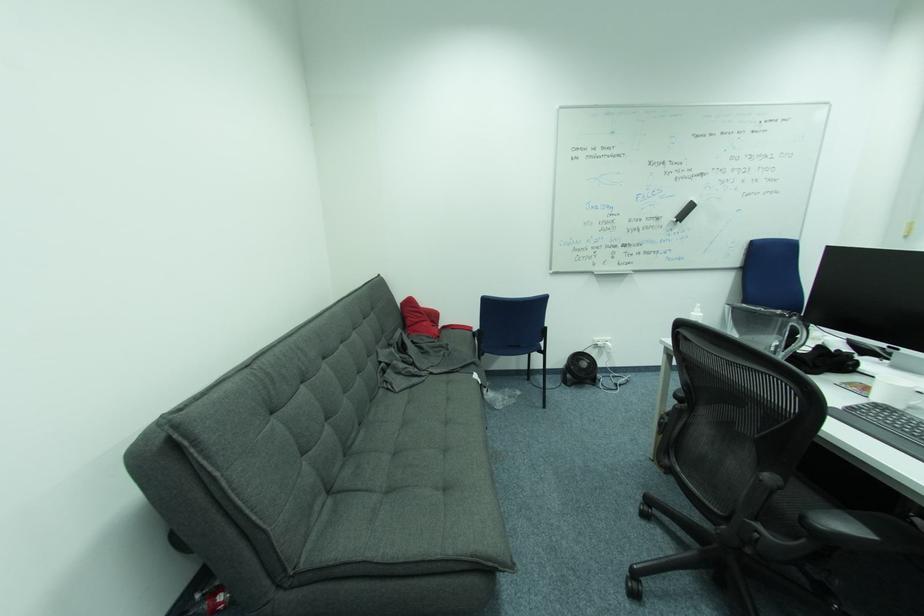
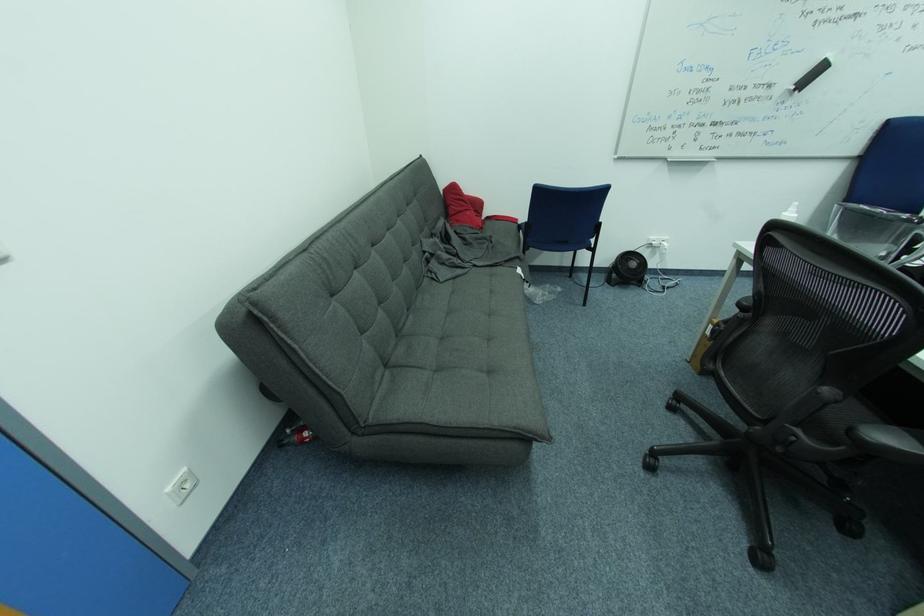
In the second image, find the point that corresponds to (x=699, y=314) in the first image.

(792, 215)